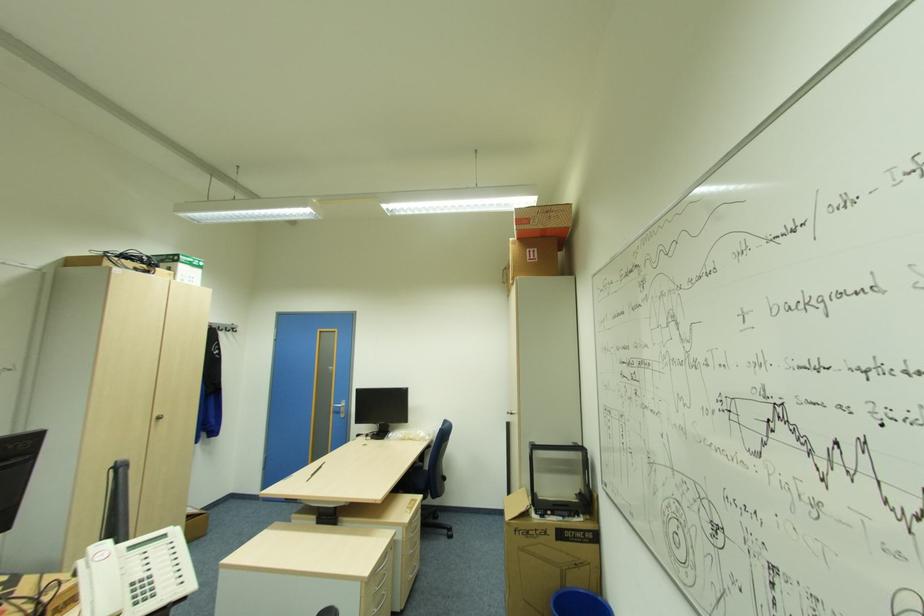
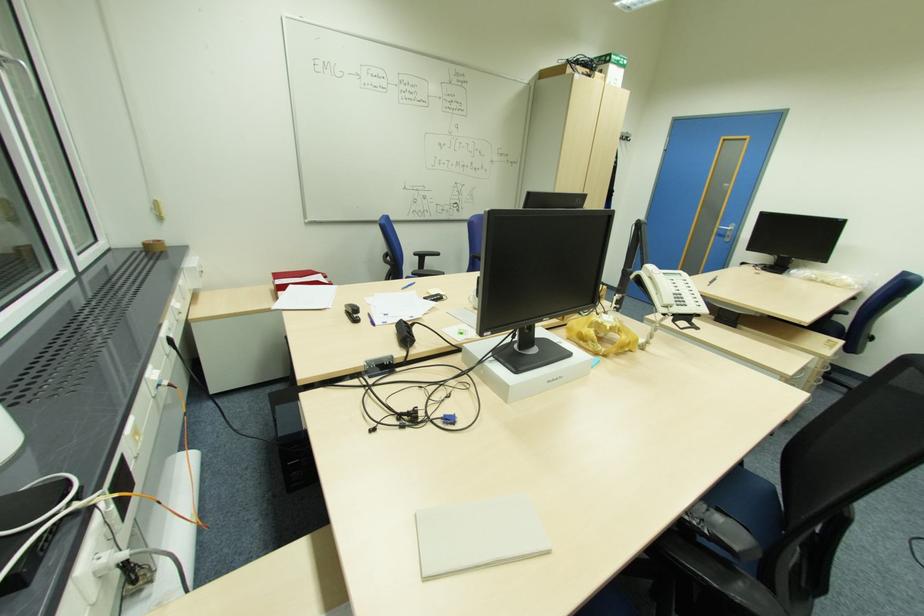
The point at [345,411] is marked in the first image. Where is the corresponding point in the second image?

(732, 236)